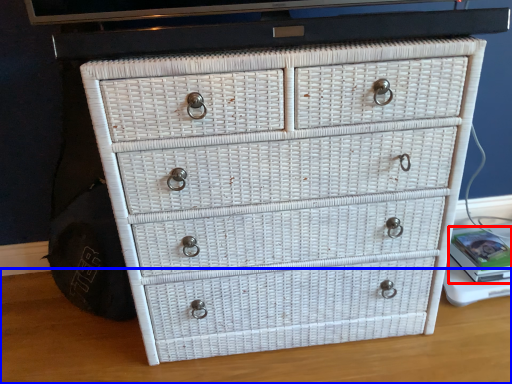
Question: Which object is further to the camera taking this photo, book (highlighted by a red box) or table top (highlighted by a blue box)?

Choices:
 (A) book
 (B) table top

Answer: (A)